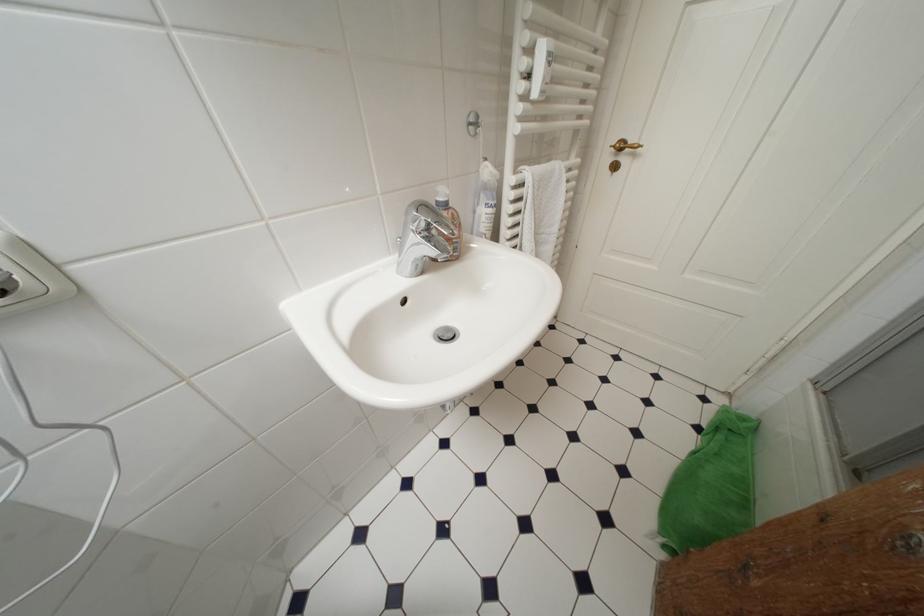
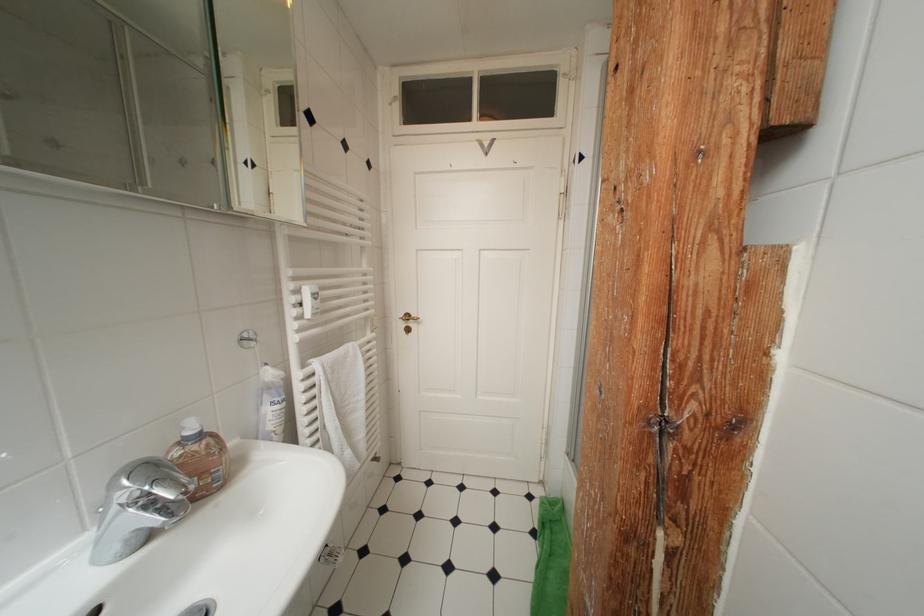
The point at (416, 270) is marked in the first image. Where is the corresponding point in the second image?

(124, 551)